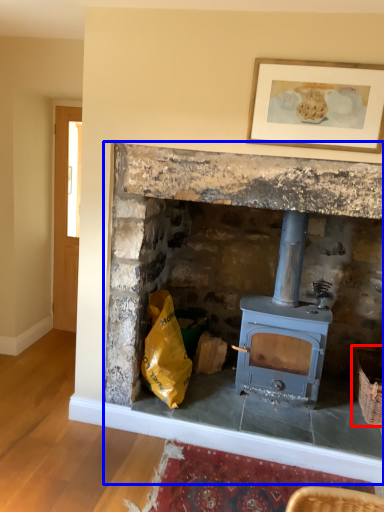
Question: Which object is closer to the camera taking this photo, basket (highlighted by a red box) or fireplace (highlighted by a blue box)?

Choices:
 (A) basket
 (B) fireplace

Answer: (B)